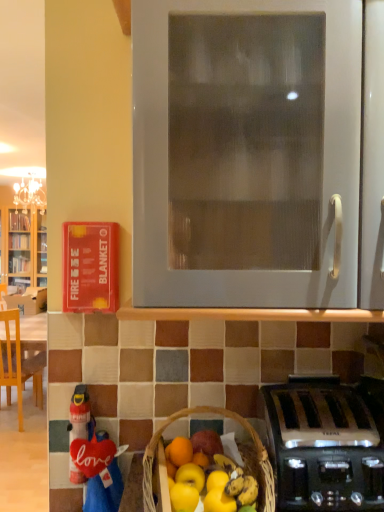
Measure the distance between point (88,435) and camera.

Point (88,435) and camera are 3.91 feet apart.

The image size is (384, 512). Describe the element at coordinates (326, 443) in the screenshot. I see `satin silver toaster at lower right` at that location.

This screenshot has width=384, height=512. Identify the location of wooden chair at left. (19, 365).

Measure the distance between brown wicker basket at lower center and camera.

brown wicker basket at lower center is 35.01 inches from camera.

What are the coordinates of `red fabric love sign at lower left` in the screenshot? It's located at (79, 414).

Is red fabric love sign at lower left oriented towards wooden chair at left?

No, red fabric love sign at lower left is not aimed at wooden chair at left.

From the image's perspective, would you say red fabric love sign at lower left is shown under wooden chair at left?

No, from the image's perspective, red fabric love sign at lower left is not beneath wooden chair at left.

Consider the image. From a real-world perspective, which is physically above, red fabric love sign at lower left or wooden chair at left?

red fabric love sign at lower left, from a real-world perspective.

Which object is positioned more to the right, red fabric love sign at lower left or wooden chair at left?

red fabric love sign at lower left is more to the right.

From the image's perspective, is satin silver toaster at lower right positioned above or below wooden chair at left?

satin silver toaster at lower right is situated higher than wooden chair at left in the image.

Is point (367, 391) positioned before point (21, 424)?

That is True.

Can you confirm if satin silver toaster at lower right is positioned to the right of wooden chair at left?

Yes, satin silver toaster at lower right is to the right of wooden chair at left.

Can you confirm if white matte oven at center is bigger than brown wicker basket at lower center?

Yes.

From a real-world perspective, which is physically below, white matte oven at center or brown wicker basket at lower center?

brown wicker basket at lower center is physically lower.

Which is in front, white matte oven at center or brown wicker basket at lower center?

brown wicker basket at lower center is in front.

Which is more distant, (x=282, y=85) or (x=266, y=400)?

The point (x=266, y=400) is farther from the camera.

From the image's perspective, which is above, white matte oven at center or satin silver toaster at lower right?

From the image's view, white matte oven at center is above.

Which object is further away from the camera taking this photo, white matte oven at center or satin silver toaster at lower right?

satin silver toaster at lower right is behind.

Is white matte oven at center aimed at satin silver toaster at lower right?

No.

Does red fabric love sign at lower left lie in front of brown wicker basket at lower center?

No, red fabric love sign at lower left is behind brown wicker basket at lower center.

Considering the relative sizes of red fabric love sign at lower left and brown wicker basket at lower center in the image provided, is red fabric love sign at lower left wider than brown wicker basket at lower center?

No, red fabric love sign at lower left is not wider than brown wicker basket at lower center.

Could you tell me if red fabric love sign at lower left is turned towards brown wicker basket at lower center?

No.

Is red fabric love sign at lower left taller or shorter than brown wicker basket at lower center?

Considering their sizes, red fabric love sign at lower left has more height than brown wicker basket at lower center.

From the picture: Between white matte oven at center and wooden chair at left, which one appears on the left side from the viewer's perspective?

wooden chair at left is more to the left.

From the image's perspective, between white matte oven at center and wooden chair at left, which one is located above?

From the image's view, white matte oven at center is above.

At what (x,y) coordinates should I click in order to perform the action: click on chair directly beneath the white matte oven at center (from a real-world perspective). Please return your answer as a coordinate pair (x, y). This screenshot has height=512, width=384. Looking at the image, I should click on (19, 365).

In the image, is white matte oven at center on the left side or the right side of red fabric love sign at lower left?

Clearly, white matte oven at center is on the right of red fabric love sign at lower left in the image.

Is white matte oven at center looking in the opposite direction of red fabric love sign at lower left?

Answer: white matte oven at center does not have its back to red fabric love sign at lower left.

Measure the distance between white matte oven at center and red fabric love sign at lower left.

They are 76.94 centimeters apart.

Locate an element on the screen. This screenshot has height=512, width=384. toy lying above the wooden chair at left (from the image's perspective) is located at coordinates (79, 414).

Locate an element on the screen. This screenshot has width=384, height=512. chair lying below the satin silver toaster at lower right (from the image's perspective) is located at coordinates (19, 365).

In the scene shown: Which object lies nearer to the anchor point wooden chair at left, white matte oven at center or red fabric love sign at lower left?

red fabric love sign at lower left is closer to wooden chair at left.

Looking at the image, which one is located closer to satin silver toaster at lower right, brown wicker basket at lower center or red fabric love sign at lower left?

brown wicker basket at lower center.

Estimate the real-world distances between objects in this image. Which object is further from red fabric love sign at lower left, brown wicker basket at lower center or satin silver toaster at lower right?

The object further to red fabric love sign at lower left is satin silver toaster at lower right.

Considering their positions, is white matte oven at center positioned closer to wooden chair at left than brown wicker basket at lower center?

brown wicker basket at lower center is positioned closer to the anchor wooden chair at left.

Looking at the image, which one is located closer to brown wicker basket at lower center, red fabric love sign at lower left or white matte oven at center?

red fabric love sign at lower left lies closer to brown wicker basket at lower center than the other object.

From the image, which object appears to be nearer to red fabric love sign at lower left, brown wicker basket at lower center or white matte oven at center?

brown wicker basket at lower center lies closer to red fabric love sign at lower left than the other object.

Which object lies nearer to the anchor point brown wicker basket at lower center, satin silver toaster at lower right or wooden chair at left?

Based on the image, satin silver toaster at lower right appears to be nearer to brown wicker basket at lower center.

From the image, which object appears to be farther from wooden chair at left, brown wicker basket at lower center or satin silver toaster at lower right?

satin silver toaster at lower right.

Where is `picnic basket between red fabric love sign at lower left and satin silver toaster at lower right in the horizontal direction`? picnic basket between red fabric love sign at lower left and satin silver toaster at lower right in the horizontal direction is located at coordinates (237, 446).

Where is `toy positioned between white matte oven at center and wooden chair at left from near to far`? The image size is (384, 512). toy positioned between white matte oven at center and wooden chair at left from near to far is located at coordinates (79, 414).

You are a GUI agent. You are given a task and a screenshot of the screen. Output one action in this format:
    pyautogui.click(x=<x>, y=<y>)
    Task: Click on the oven between brown wicker basket at lower center and wooden chair at left in the front-back direction
    This screenshot has height=512, width=384.
    Given the screenshot: What is the action you would take?
    pyautogui.click(x=245, y=152)

Locate an element on the screen. This screenshot has height=512, width=384. toy between brown wicker basket at lower center and wooden chair at left in the front-back direction is located at coordinates (79, 414).